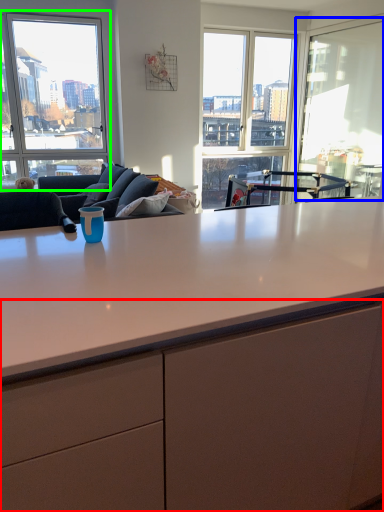
Question: Which object is positioned farthest from cabinetry (highlighted by a red box)? Select from window screen (highlighted by a blue box) and window (highlighted by a green box).

Choices:
 (A) window screen
 (B) window

Answer: (B)